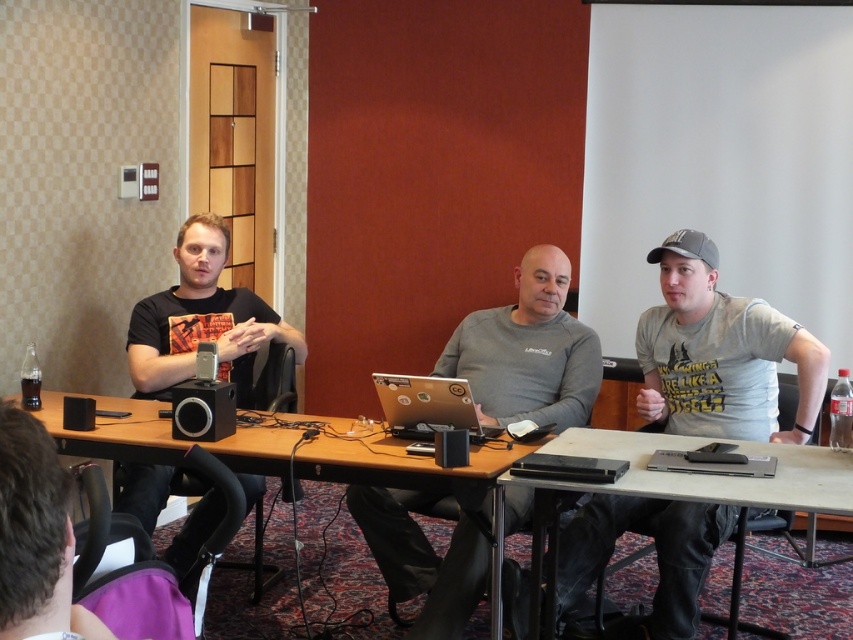
Between silver metallic laptop at center and satin black laptop at lower right, which one is positioned higher?

silver metallic laptop at center is higher up.

Where is `silver metallic laptop at center`? The height and width of the screenshot is (640, 853). silver metallic laptop at center is located at coordinates (427, 404).

Between wooden table at center and silver metallic laptop at center, which one appears on the left side from the viewer's perspective?

From the viewer's perspective, wooden table at center appears more on the left side.

Describe the element at coordinates (387, 458) in the screenshot. I see `wooden table at center` at that location.

The height and width of the screenshot is (640, 853). I want to click on wooden table at center, so click(387, 458).

Consider the image. Is matte black laptop at center above silver metallic laptop at center?

Actually, matte black laptop at center is below silver metallic laptop at center.

Does point (807, 476) come closer to viewer compared to point (424, 435)?

Yes, point (807, 476) is in front of point (424, 435).

Locate an element on the screen. matte black laptop at center is located at coordinates (674, 486).